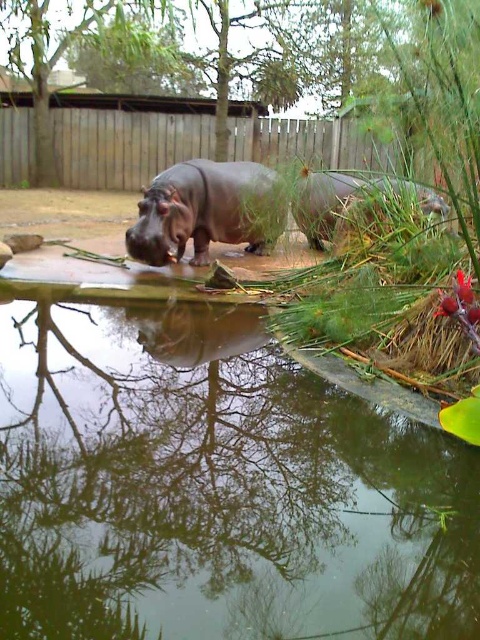
Is brown matte hippo at center taller than brown matte rhinoceros at right?

Yes, brown matte hippo at center is taller than brown matte rhinoceros at right.

This screenshot has width=480, height=640. Find the location of `brown matte hippo at center`. brown matte hippo at center is located at coordinates (207, 211).

Is point (193, 164) positioned before point (300, 193)?

No, it is behind (300, 193).

Where is `brown matte hippo at center`? The width and height of the screenshot is (480, 640). brown matte hippo at center is located at coordinates (207, 211).

Between green reflective water at center and brown matte hippo at center, which one appears on the left side from the viewer's perspective?

From the viewer's perspective, green reflective water at center appears more on the left side.

Can you confirm if green reflective water at center is smaller than brown matte hippo at center?

Yes, green reflective water at center is smaller than brown matte hippo at center.

What do you see at coordinates (231, 497) in the screenshot? This screenshot has width=480, height=640. I see `green reflective water at center` at bounding box center [231, 497].

This screenshot has width=480, height=640. I want to click on green reflective water at center, so click(231, 497).

Can you confirm if green reflective water at center is positioned to the right of brown matte rhinoceros at right?

No, green reflective water at center is not to the right of brown matte rhinoceros at right.

Is green reflective water at center above brown matte rhinoceros at right?

No.

Describe the element at coordinates (231, 497) in the screenshot. I see `green reflective water at center` at that location.

Where is `green reflective water at center`? green reflective water at center is located at coordinates (231, 497).